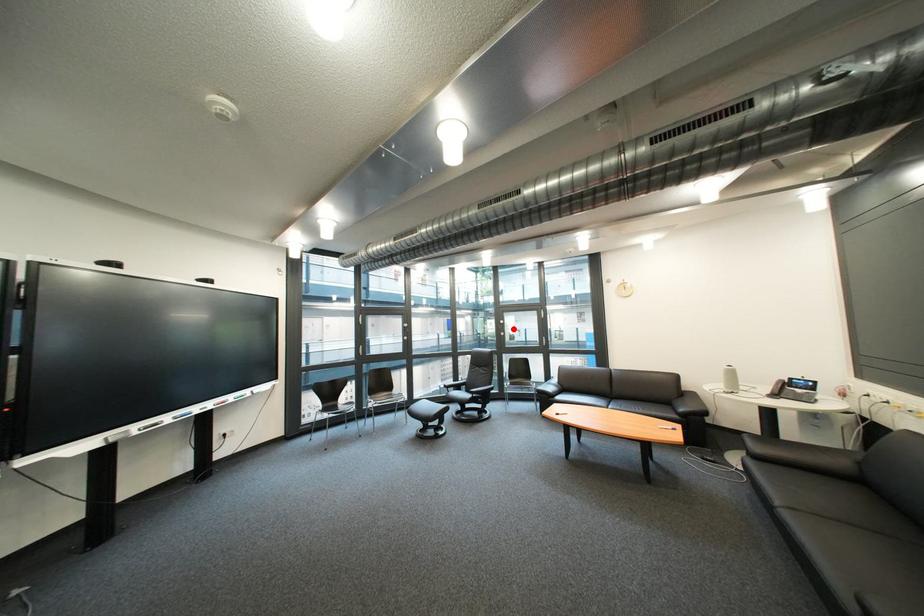
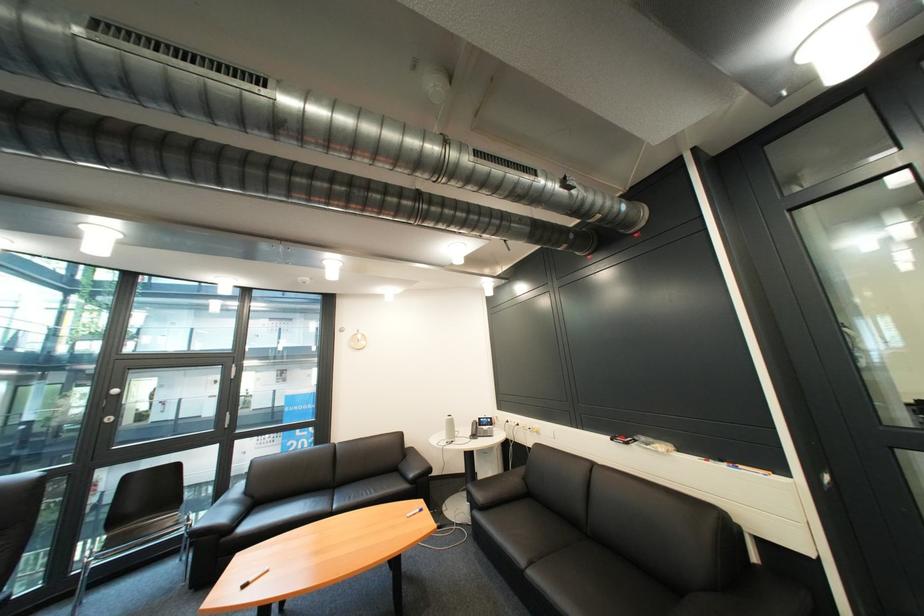
Question: A red point is marked in image1. In image2, is the corresponding 3D point closer to the camera or farther? Reply with the corresponding letter.

Choices:
 (A) The corresponding 3D point is closer.
 (B) The corresponding 3D point is farther.

Answer: (A)